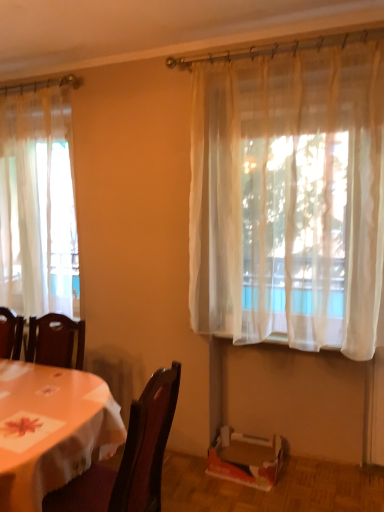
Locate an element on the screen. vacant space in sheer white curtain at upper right, placed as the second curtain when sorted from back to front (from a real-world perspective) is located at coordinates (283, 492).